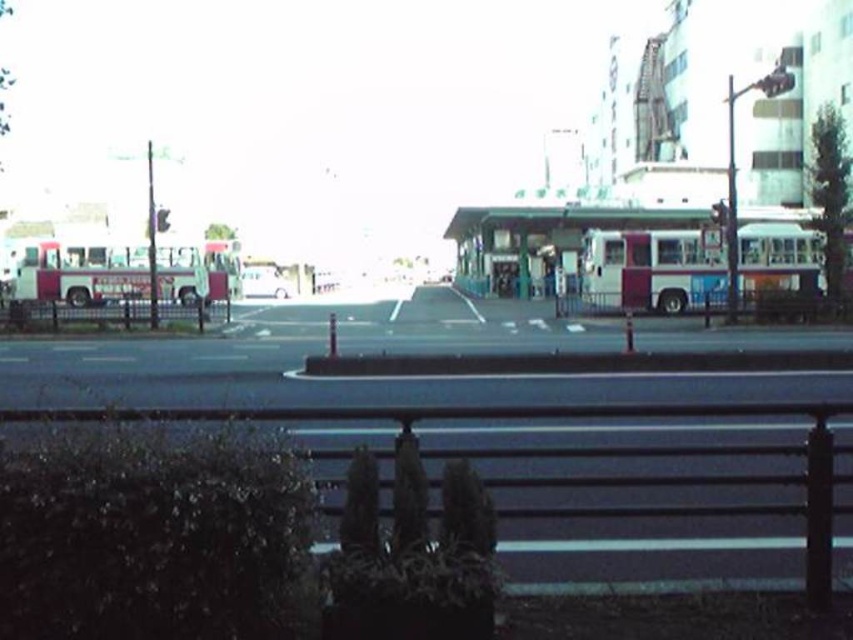
Is white matte bus at right to the left of white glossy car at center from the viewer's perspective?

In fact, white matte bus at right is to the right of white glossy car at center.

I want to click on white matte bus at right, so click(654, 269).

Locate an element on the screen. This screenshot has height=640, width=853. white matte bus at right is located at coordinates (654, 269).

Is white matte bus at right to the right of green plastic bus stop at center from the viewer's perspective?

Correct, you'll find white matte bus at right to the right of green plastic bus stop at center.

Between point (595, 294) and point (474, 253), which one is positioned in front?

Point (595, 294) is more forward.

Find the location of a particular element. This screenshot has width=853, height=640. white matte bus at right is located at coordinates (654, 269).

Locate an element on the screen. white matte bus at right is located at coordinates (654, 269).

Is white glossy fire truck at left further to the viewer compared to green plastic bus stop at center?

No, it is in front of green plastic bus stop at center.

Is white glossy fire truck at left to the right of green plastic bus stop at center from the viewer's perspective?

Incorrect, white glossy fire truck at left is not on the right side of green plastic bus stop at center.

Does point (190, 252) come behind point (538, 237)?

No, it is in front of (538, 237).

Find the location of `white glossy fire truck at left`. white glossy fire truck at left is located at coordinates (76, 269).